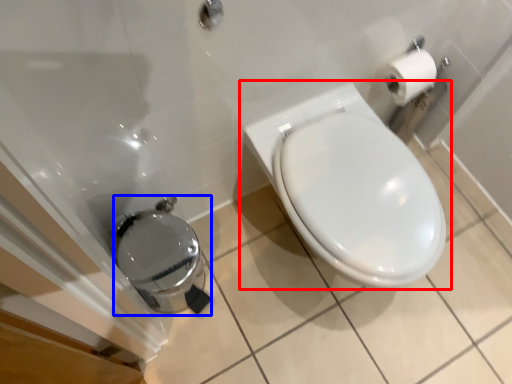
Question: Which point is further to the camera, toilet (highlighted by a red box) or porcelain (highlighted by a blue box)?

Choices:
 (A) toilet
 (B) porcelain

Answer: (B)